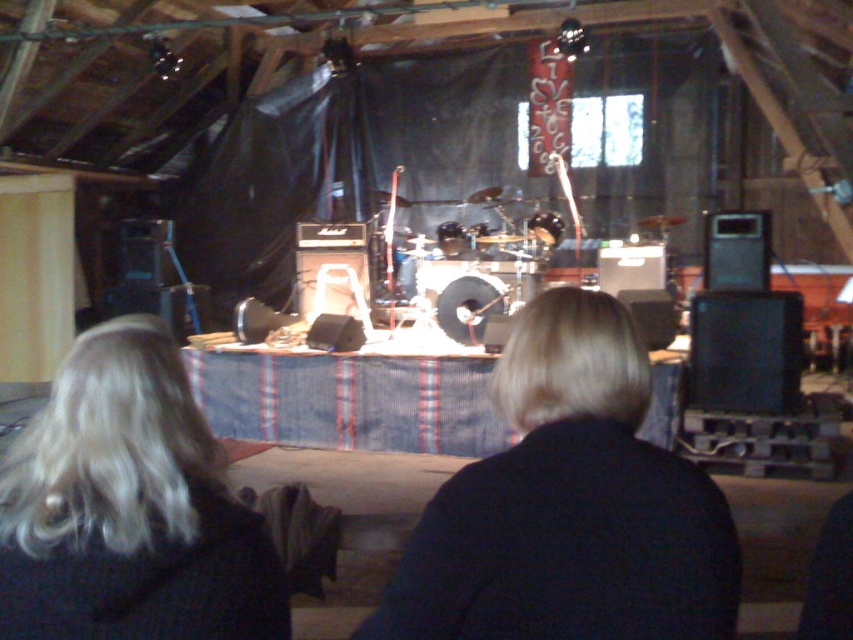
You are a photographer at a concert venue and need to capture a closeup shot of the drummer. You notice two people with blonde hair at center and blonde hair at lower left. Which one should you focus on to ensure you capture the drummer?

The drummer is the larger of the two, so you should focus on the blonde hair at center since it is larger in size than the blonde hair at lower left.